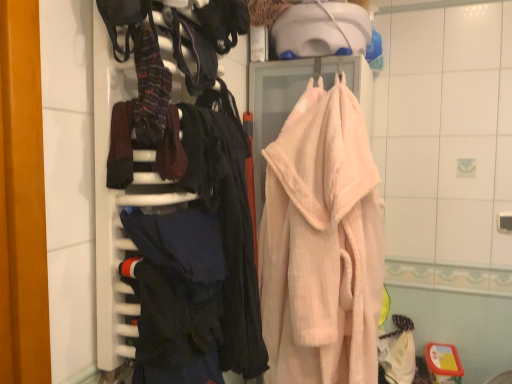
Question: Considering the relative sizes of dark blue fabric at left and dark blue fabric at center, the second clothing viewed from the top, in the image provided, is dark blue fabric at left thinner than dark blue fabric at center, the second clothing viewed from the top,?

Choices:
 (A) yes
 (B) no

Answer: (B)

Question: From the image's perspective, is dark blue fabric at left above dark blue fabric at center, the 1th clothing in the bottom-to-top sequence?

Choices:
 (A) yes
 (B) no

Answer: (A)

Question: Does dark blue fabric at left appear on the left side of dark blue fabric at center, the 1th clothing in the bottom-to-top sequence?

Choices:
 (A) yes
 (B) no

Answer: (A)

Question: Is dark blue fabric at left far away from dark blue fabric at center, the 1th clothing in the bottom-to-top sequence?

Choices:
 (A) yes
 (B) no

Answer: (B)

Question: Considering the relative sizes of dark blue fabric at left and dark blue fabric at center, the second clothing viewed from the top, in the image provided, is dark blue fabric at left taller than dark blue fabric at center, the second clothing viewed from the top,?

Choices:
 (A) no
 (B) yes

Answer: (B)

Question: Does dark blue fabric at left appear on the right side of dark blue fabric at center, the second clothing viewed from the top?

Choices:
 (A) yes
 (B) no

Answer: (B)

Question: Considering the relative positions of striped wool socks at upper left, placed as the 1th clothing when sorted from top to bottom, and pink fluffy bathrobe at center in the image provided, is striped wool socks at upper left, placed as the 1th clothing when sorted from top to bottom, to the left of pink fluffy bathrobe at center from the viewer's perspective?

Choices:
 (A) yes
 (B) no

Answer: (A)

Question: Is striped wool socks at upper left, placed as the 1th clothing when sorted from top to bottom, closer to the viewer compared to pink fluffy bathrobe at center?

Choices:
 (A) no
 (B) yes

Answer: (B)

Question: Would you say pink fluffy bathrobe at center is part of striped wool socks at upper left, placed as the 1th clothing when sorted from top to bottom,'s contents?

Choices:
 (A) no
 (B) yes

Answer: (A)

Question: From a real-world perspective, does striped wool socks at upper left, which appears as the 2th clothing when ordered from the bottom, stand above pink fluffy bathrobe at center?

Choices:
 (A) yes
 (B) no

Answer: (A)

Question: From a real-world perspective, is striped wool socks at upper left, placed as the 1th clothing when sorted from top to bottom, below pink fluffy bathrobe at center?

Choices:
 (A) yes
 (B) no

Answer: (B)

Question: Considering the relative sizes of striped wool socks at upper left, which appears as the 2th clothing when ordered from the bottom, and pink fluffy bathrobe at center in the image provided, is striped wool socks at upper left, which appears as the 2th clothing when ordered from the bottom, thinner than pink fluffy bathrobe at center?

Choices:
 (A) yes
 (B) no

Answer: (A)

Question: Does dark blue fabric at left have a lesser height compared to striped wool socks at upper left, placed as the 1th clothing when sorted from top to bottom?

Choices:
 (A) yes
 (B) no

Answer: (B)